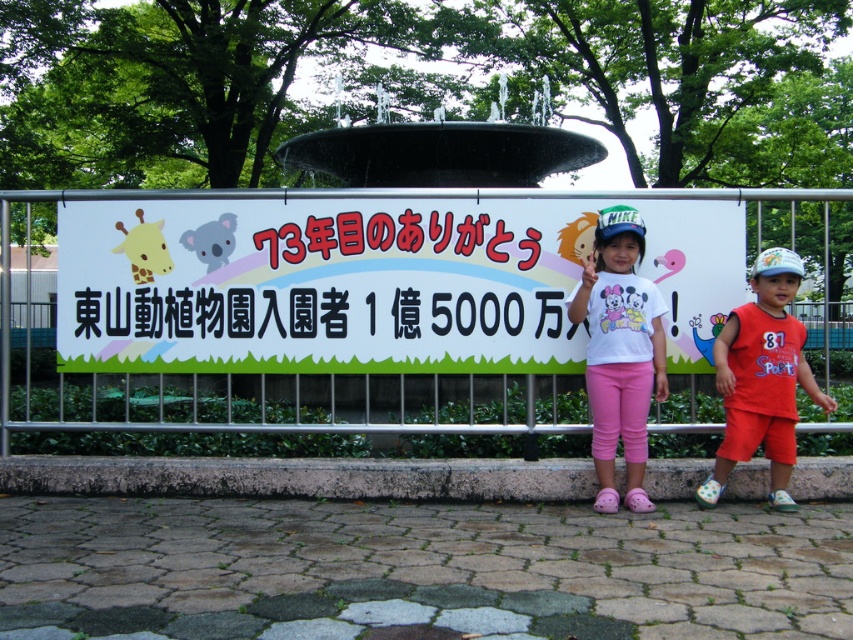
Question: Considering the relative positions of pink fabric pants at center and white cotton shirt at center in the image provided, where is pink fabric pants at center located with respect to white cotton shirt at center?

Choices:
 (A) left
 (B) right

Answer: (B)

Question: Is white paper sign at center closer to camera compared to pink fabric pants at center?

Choices:
 (A) yes
 (B) no

Answer: (B)

Question: Which point is closer to the camera?

Choices:
 (A) pink fabric pants at center
 (B) white paper sign at center
 (C) orange cotton shorts at right

Answer: (C)

Question: Estimate the real-world distances between objects in this image. Which object is farther from the pink fabric pants at center?

Choices:
 (A) white cotton shirt at center
 (B) white paper sign at center
 (C) orange cotton shorts at right

Answer: (B)

Question: Can you confirm if pink fabric pants at center is positioned to the right of orange cotton shorts at right?

Choices:
 (A) yes
 (B) no

Answer: (B)

Question: Among these points, which one is farthest from the camera?

Choices:
 (A) (724, 390)
 (B) (665, 266)

Answer: (B)